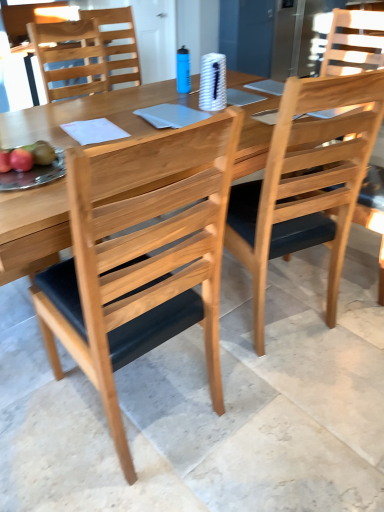
Question: Could natural wood table at center be considered to be inside natural wood chair at center, which is the 1th chair from front to back?

Choices:
 (A) yes
 (B) no

Answer: (B)

Question: Is natural wood chair at center, placed as the third chair when sorted from back to front, shorter than natural wood table at center?

Choices:
 (A) no
 (B) yes

Answer: (A)

Question: Is natural wood chair at center, which is the 1th chair from front to back, facing towards natural wood table at center?

Choices:
 (A) yes
 (B) no

Answer: (A)

Question: Can you confirm if natural wood chair at center, which is the 1th chair from front to back, is thinner than natural wood table at center?

Choices:
 (A) no
 (B) yes

Answer: (B)

Question: Does natural wood chair at center, which is the 1th chair from front to back, have a smaller size compared to natural wood table at center?

Choices:
 (A) yes
 (B) no

Answer: (A)

Question: From the image's perspective, is shiny red apple at left, the first fruit in the back-to-front sequence, located above or below natural wood chair at center, which is the 1th chair from front to back?

Choices:
 (A) below
 (B) above

Answer: (B)

Question: Is shiny red apple at left, which is counted as the second fruit, starting from the front, inside or outside of natural wood chair at center, placed as the third chair when sorted from back to front?

Choices:
 (A) inside
 (B) outside

Answer: (B)

Question: In the image, is shiny red apple at left, which is counted as the second fruit, starting from the front, positioned in front of or behind natural wood chair at center, which is the 1th chair from front to back?

Choices:
 (A) behind
 (B) front

Answer: (A)

Question: Based on their sizes in the image, would you say shiny red apple at left, which is counted as the second fruit, starting from the front, is bigger or smaller than natural wood chair at center, placed as the third chair when sorted from back to front?

Choices:
 (A) big
 (B) small

Answer: (B)

Question: Is natural wood chair at upper left, which is the third chair in front-to-back order, to the left or to the right of light brown wood chair at center, acting as the second chair starting from the front, in the image?

Choices:
 (A) left
 (B) right

Answer: (A)

Question: From their relative heights in the image, would you say natural wood chair at upper left, acting as the 1th chair starting from the back, is taller or shorter than light brown wood chair at center, marked as the second chair in a back-to-front arrangement?

Choices:
 (A) tall
 (B) short

Answer: (B)

Question: Looking at their shapes, would you say natural wood chair at upper left, which is the third chair in front-to-back order, is wider or thinner than light brown wood chair at center, marked as the second chair in a back-to-front arrangement?

Choices:
 (A) thin
 (B) wide

Answer: (A)

Question: Would you say natural wood chair at upper left, which is the third chair in front-to-back order, is inside or outside light brown wood chair at center, acting as the second chair starting from the front?

Choices:
 (A) outside
 (B) inside

Answer: (A)

Question: Based on their positions, is shiny red apple at left, which is counted as the second fruit, starting from the front, located to the left or right of natural wood chair at upper left, which is the third chair in front-to-back order?

Choices:
 (A) right
 (B) left

Answer: (B)

Question: Is point (1, 157) positioned closer to the camera than point (127, 11)?

Choices:
 (A) farther
 (B) closer

Answer: (B)